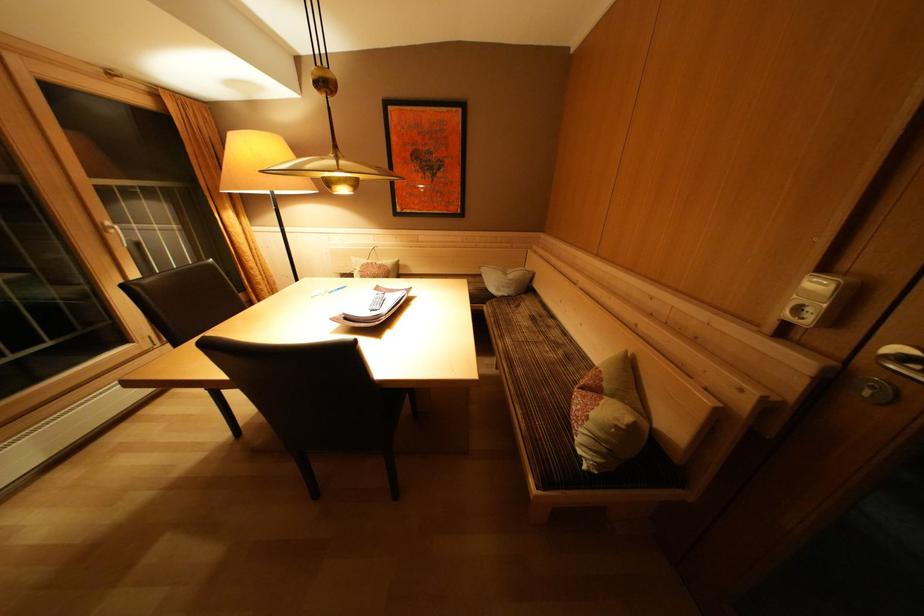
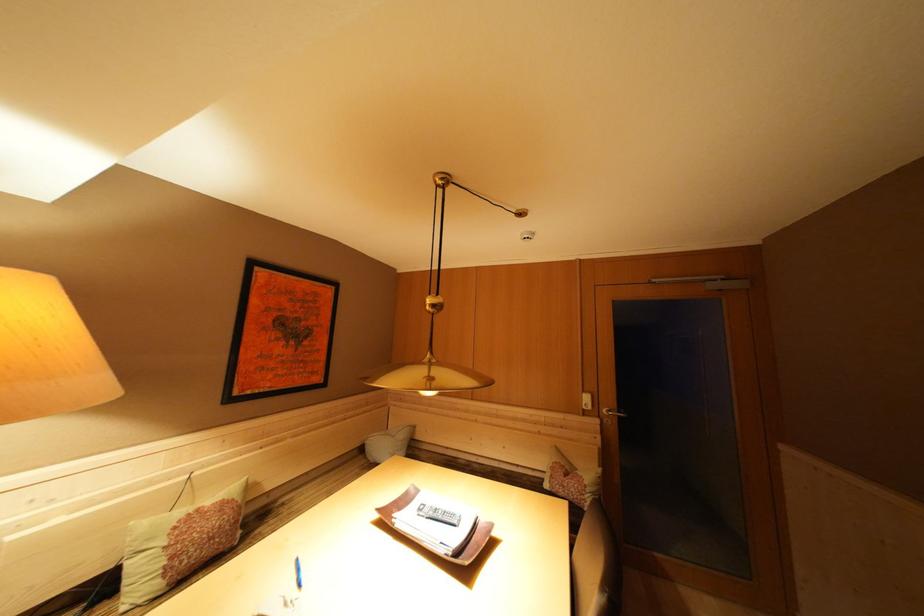
Where in the second image is the point corresponding to (385,292) from the first image?

(384, 515)